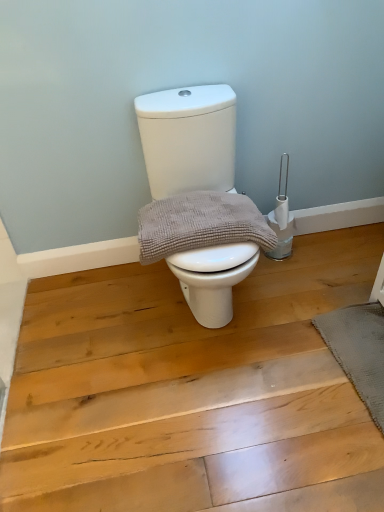
Question: Does white glossy toilet at center contain gray textured bath mat at lower right?

Choices:
 (A) yes
 (B) no

Answer: (B)

Question: Does white glossy toilet at center have a smaller size compared to gray textured bath mat at lower right?

Choices:
 (A) yes
 (B) no

Answer: (B)

Question: Can you confirm if white glossy toilet at center is wider than gray textured bath mat at lower right?

Choices:
 (A) no
 (B) yes

Answer: (B)

Question: Is white glossy toilet at center further to the viewer compared to gray textured bath mat at lower right?

Choices:
 (A) no
 (B) yes

Answer: (A)

Question: Is white glossy toilet at center positioned in front of gray textured bath mat at lower right?

Choices:
 (A) yes
 (B) no

Answer: (A)

Question: Is white glossy toilet at center far away from gray textured bath mat at lower right?

Choices:
 (A) yes
 (B) no

Answer: (B)

Question: Can you confirm if white glossy toilet at center is taller than gray textured towel at center?

Choices:
 (A) yes
 (B) no

Answer: (A)

Question: Considering the relative positions of white glossy toilet at center and gray textured towel at center in the image provided, is white glossy toilet at center behind gray textured towel at center?

Choices:
 (A) yes
 (B) no

Answer: (B)

Question: Can you confirm if white glossy toilet at center is shorter than gray textured towel at center?

Choices:
 (A) no
 (B) yes

Answer: (A)

Question: Is gray textured towel at center completely or partially inside white glossy toilet at center?

Choices:
 (A) no
 (B) yes

Answer: (B)

Question: Can you confirm if white glossy toilet at center is positioned to the left of gray textured towel at center?

Choices:
 (A) yes
 (B) no

Answer: (B)

Question: From the image's perspective, is white glossy toilet at center located beneath gray textured towel at center?

Choices:
 (A) yes
 (B) no

Answer: (B)

Question: Would you say gray textured towel at center is a long distance from gray textured bath mat at lower right?

Choices:
 (A) yes
 (B) no

Answer: (B)